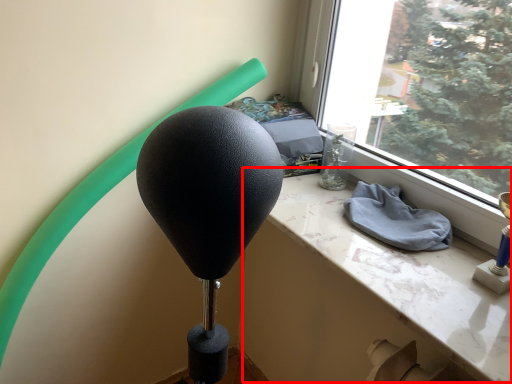
Question: From the image's perspective, what is the correct spatial positioning of table (annotated by the red box) in reference to cloth?

Choices:
 (A) above
 (B) below

Answer: (B)